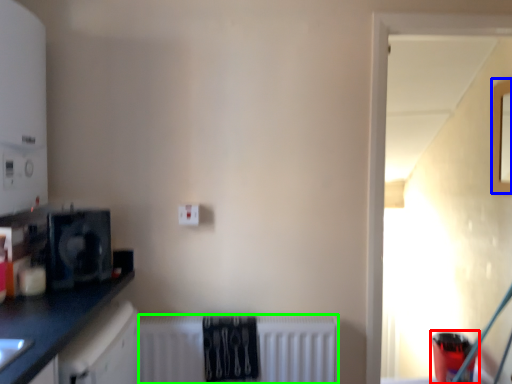
Question: Which is farther away from appliance (highlighted by a red box)? window (highlighted by a blue box) or radiator (highlighted by a green box)?

Choices:
 (A) window
 (B) radiator

Answer: (B)